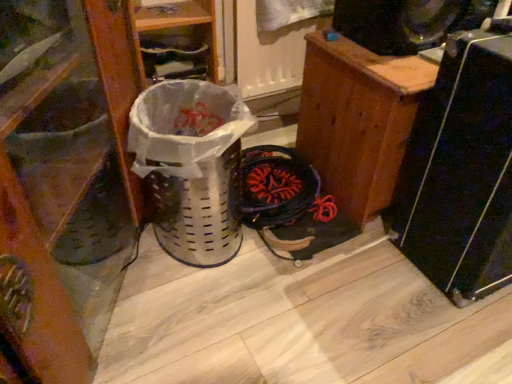
Question: Considering the relative sizes of white plastic basket at center and black plastic speaker at upper right in the image provided, is white plastic basket at center smaller than black plastic speaker at upper right?

Choices:
 (A) yes
 (B) no

Answer: (B)

Question: Can we say white plastic basket at center lies outside black plastic speaker at upper right?

Choices:
 (A) yes
 (B) no

Answer: (A)

Question: Is white plastic basket at center taller than black plastic speaker at upper right?

Choices:
 (A) yes
 (B) no

Answer: (A)

Question: Does white plastic basket at center come behind black plastic speaker at upper right?

Choices:
 (A) no
 (B) yes

Answer: (A)

Question: Is white plastic basket at center in front of black plastic speaker at upper right?

Choices:
 (A) no
 (B) yes

Answer: (B)

Question: From the image's perspective, is white plastic basket at center under black plastic speaker at upper right?

Choices:
 (A) no
 (B) yes

Answer: (B)

Question: Can you see transparent plastic screen door at upper center touching wooden cabinet at right, which ranks as the second furniture in left-to-right order?

Choices:
 (A) no
 (B) yes

Answer: (A)

Question: Is transparent plastic screen door at upper center bigger than wooden cabinet at right, the first furniture when ordered from right to left?

Choices:
 (A) yes
 (B) no

Answer: (B)

Question: Does transparent plastic screen door at upper center appear on the right side of wooden cabinet at right, the first furniture when ordered from right to left?

Choices:
 (A) no
 (B) yes

Answer: (A)

Question: From a real-world perspective, is transparent plastic screen door at upper center physically below wooden cabinet at right, the first furniture when ordered from right to left?

Choices:
 (A) no
 (B) yes

Answer: (A)

Question: Is transparent plastic screen door at upper center turned away from wooden cabinet at right, which ranks as the second furniture in left-to-right order?

Choices:
 (A) no
 (B) yes

Answer: (A)

Question: Is transparent plastic screen door at upper center positioned behind wooden cabinet at right, which ranks as the second furniture in left-to-right order?

Choices:
 (A) no
 (B) yes

Answer: (B)

Question: Is black plastic speaker at right smaller than wooden shoe at left, arranged as the 1th furniture when viewed from the left?

Choices:
 (A) yes
 (B) no

Answer: (A)